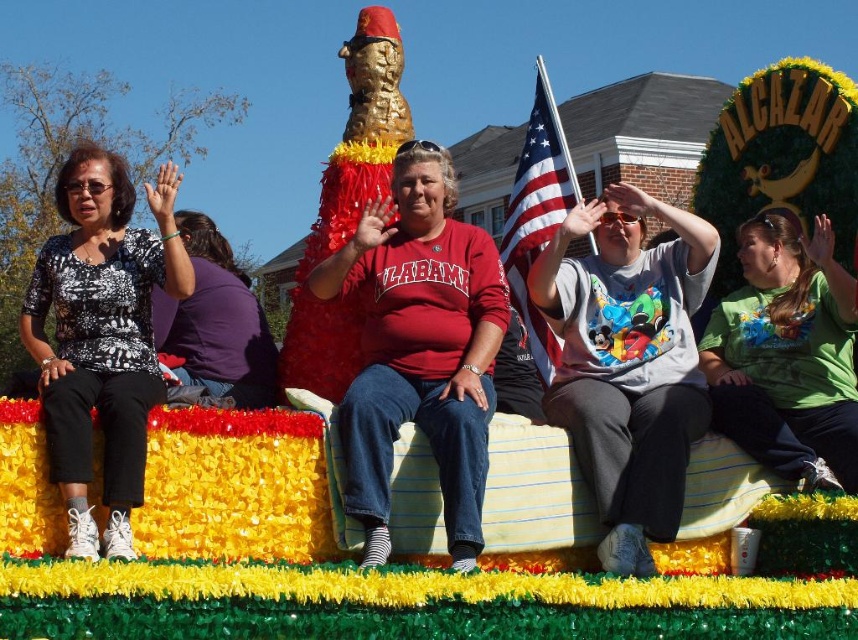
Does matte red sweatshirt at center have a lesser height compared to green matte shirt at center?

No.

Who is positioned more to the right, matte red sweatshirt at center or green matte shirt at center?

green matte shirt at center

Who is more distant from viewer, [385,508] or [781,224]?

The point [781,224] is more distant.

I want to click on matte red sweatshirt at center, so click(x=420, y=348).

Can you confirm if printed fabric blouse at left is wider than green matte shirt at center?

Yes, printed fabric blouse at left is wider than green matte shirt at center.

Does printed fabric blouse at left have a larger size compared to green matte shirt at center?

Incorrect, printed fabric blouse at left is not larger than green matte shirt at center.

Between point (143, 284) and point (832, 408), which one is positioned in front?

Point (143, 284) is in front.

Locate an element on the screen. The image size is (858, 640). printed fabric blouse at left is located at coordinates (101, 337).

In the scene shown: Who is positioned more to the right, printed fabric blouse at left or american flag at center?

american flag at center is more to the right.

Which is behind, point (131, 294) or point (559, 138)?

Point (559, 138)

Locate an element on the screen. The width and height of the screenshot is (858, 640). printed fabric blouse at left is located at coordinates (101, 337).